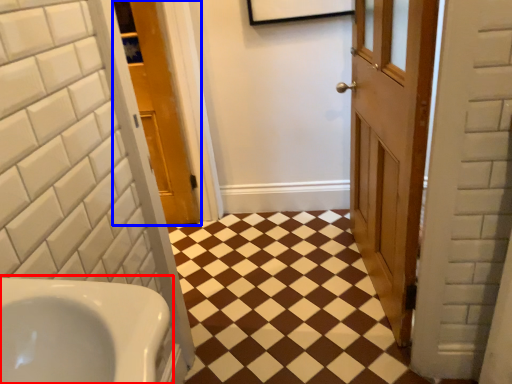
Question: Which of the following is the closest to the observer, sink (highlighted by a red box) or door (highlighted by a blue box)?

Choices:
 (A) sink
 (B) door

Answer: (A)